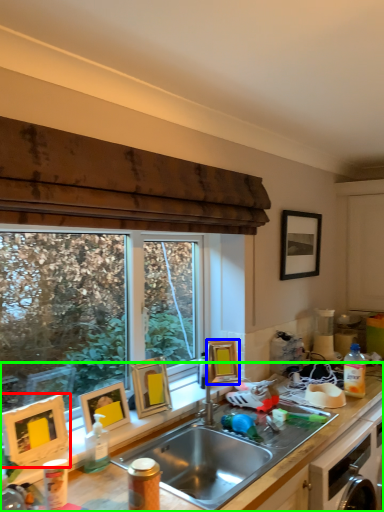
Question: Which object is positioned farthest from picture frame (highlighted by a red box)? Select from picture frame (highlighted by a blue box) and cabinetry (highlighted by a green box).

Choices:
 (A) picture frame
 (B) cabinetry

Answer: (A)